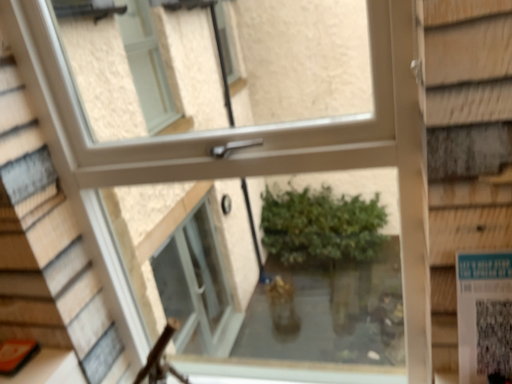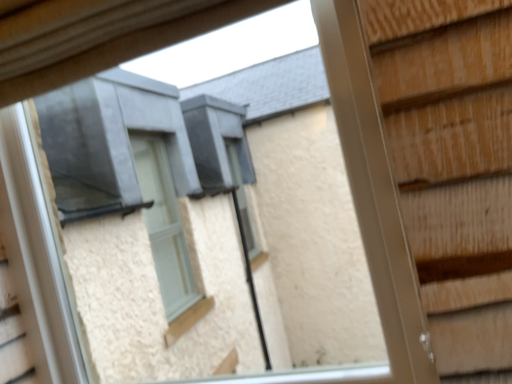
Question: How did the camera likely rotate when shooting the video?

Choices:
 (A) rotated downward
 (B) rotated upward

Answer: (B)